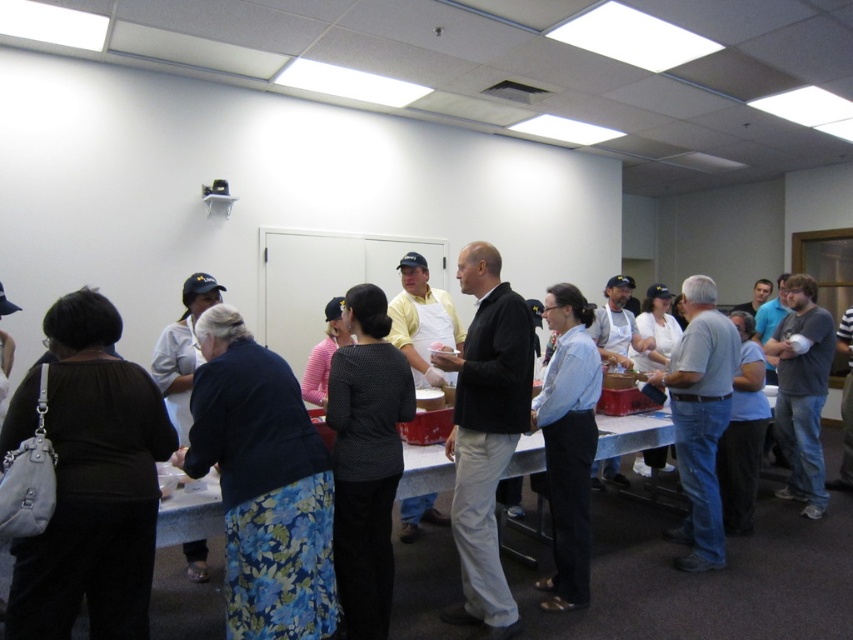
You are organizing a clothing display and need to arrange the black matte jacket at center and the black dotted shirt at center on a rack. Which item should you place first if you want to follow the size order from largest to smallest?

You should place the black matte jacket at center first because it is larger in size than the black dotted shirt at center.

Based on the photo, you are standing at the entrance of the room and want to reach the point marked as point (654, 564). There is an obstacle at point (808, 493). Can you walk directly to your destination without going around the obstacle?

Point (654, 564) is in front of point (808, 493), so you can walk directly to point (654, 564) without going around the obstacle at point (808, 493).